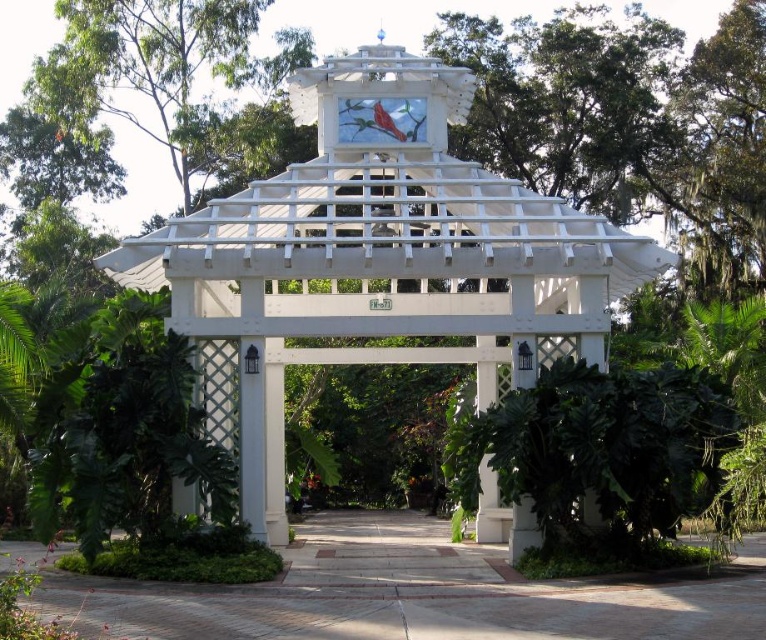
Who is positioned more to the right, white lattice gazebo at center or paved stone path at center?

Positioned to the right is white lattice gazebo at center.

Which of these two, white lattice gazebo at center or paved stone path at center, stands shorter?

paved stone path at center is shorter.

Is point (119, 248) farther from camera compared to point (375, 532)?

Yes.

Locate an element on the screen. Image resolution: width=766 pixels, height=640 pixels. white lattice gazebo at center is located at coordinates (381, 256).